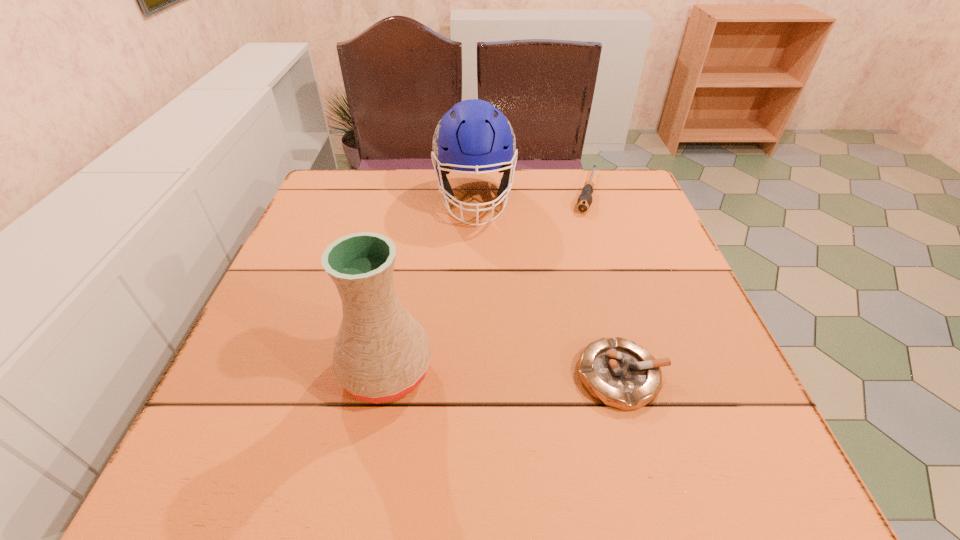
What are the coordinates of `pottery` in the screenshot? It's located at pyautogui.click(x=381, y=353).

Find the location of a particular element. This screenshot has width=960, height=540. ashtray is located at coordinates (618, 372).

Locate an element on the screen. The width and height of the screenshot is (960, 540). screwdriver is located at coordinates (584, 201).

Where is `football helmet`? football helmet is located at coordinates (473, 135).

What are the coordinates of `vacant space situated 0.240m on the back of the pottery` in the screenshot? It's located at (408, 254).

Locate an element on the screen. vacant space located on the back of the ashtray is located at coordinates (584, 238).

Find the location of a particular element. Image resolution: width=960 pixels, height=540 pixels. vacant space located 0.200m at the tip of the screwdriver is located at coordinates (576, 263).

This screenshot has height=540, width=960. I want to click on free space located 0.250m at the tip of the screwdriver, so click(x=572, y=277).

At what (x,y) coordinates should I click in order to perform the action: click on vacant space situated at the tip of the screwdriver. Please return your answer as a coordinate pair (x, y). The height and width of the screenshot is (540, 960). Looking at the image, I should click on pyautogui.click(x=567, y=293).

Where is `free space located on the face guard of the football helmet`? The width and height of the screenshot is (960, 540). free space located on the face guard of the football helmet is located at coordinates (483, 319).